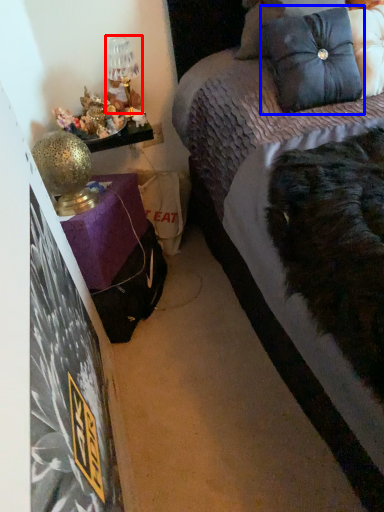
Question: Which object appears closest to the camera in this image, table lamp (highlighted by a red box) or pillow (highlighted by a blue box)?

Choices:
 (A) table lamp
 (B) pillow

Answer: (B)